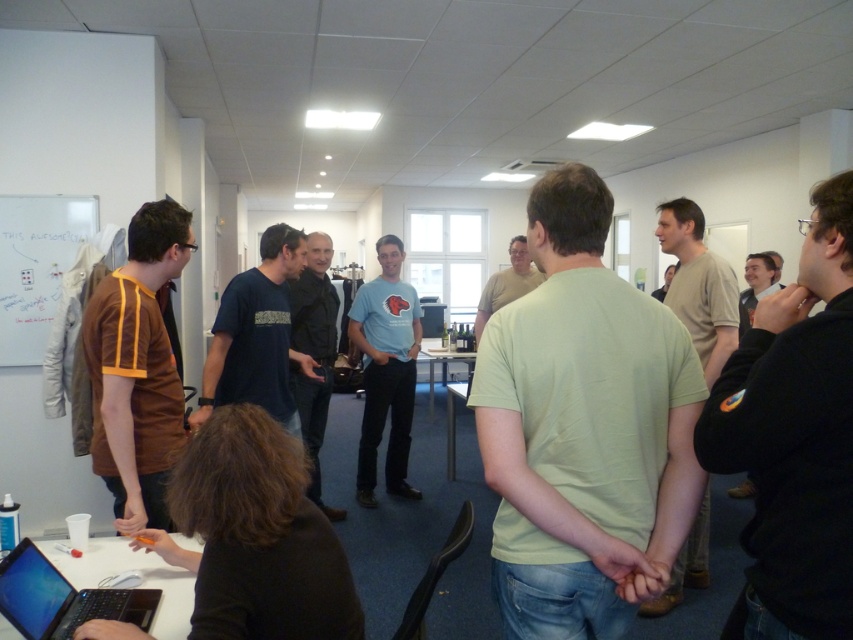
What do you see at coordinates (583, 428) in the screenshot?
I see `light green cotton t-shirt at center` at bounding box center [583, 428].

Can you confirm if light green cotton t-shirt at center is thinner than light blue t-shirt at center?

In fact, light green cotton t-shirt at center might be wider than light blue t-shirt at center.

Does point (480, 353) come in front of point (402, 467)?

Yes, point (480, 353) is in front of point (402, 467).

The image size is (853, 640). I want to click on light green cotton t-shirt at center, so click(583, 428).

Does black fabric jacket at right appear over white glossy table at center?

Yes, black fabric jacket at right is above white glossy table at center.

Consider the image. Who is more forward, (761, 294) or (469, 355)?

Point (761, 294) is in front.

Where is `black fabric jacket at right`? black fabric jacket at right is located at coordinates (757, 284).

Looking at this image, can you confirm if matte black laptop at lower left is taller than white glossy table at center?

Incorrect, matte black laptop at lower left's height is not larger of white glossy table at center's.

Is matte black laptop at lower left wider than white glossy table at center?

No, matte black laptop at lower left is not wider than white glossy table at center.

Does point (10, 596) come farther from viewer compared to point (430, 403)?

No, it is not.

Locate an element on the screen. This screenshot has width=853, height=640. matte black laptop at lower left is located at coordinates (62, 598).